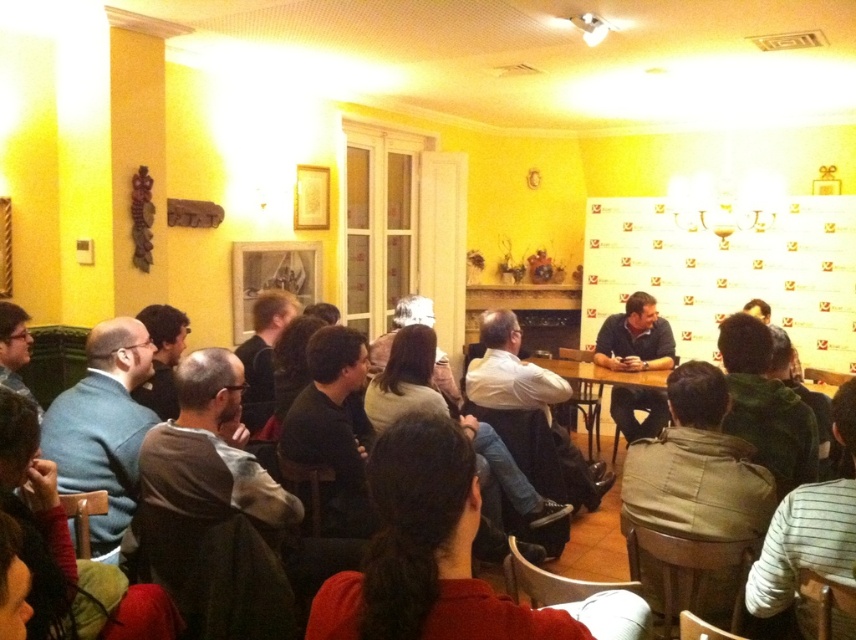
Does dark blue shirt at center come in front of wooden table at center?

That is False.

Between point (648, 410) and point (601, 371), which one is positioned behind?

The point (648, 410) is more distant.

The height and width of the screenshot is (640, 856). I want to click on dark blue shirt at center, so click(635, 339).